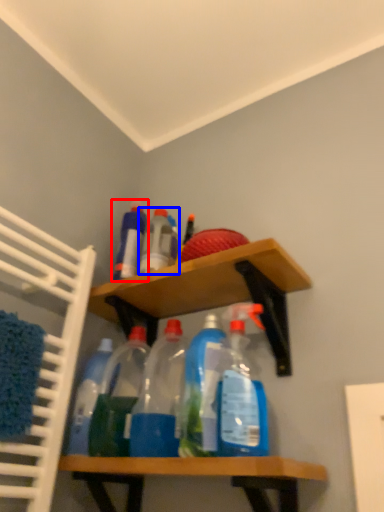
Question: Which of the following is the farthest to the observer, bottle (highlighted by a red box) or bottle (highlighted by a blue box)?

Choices:
 (A) bottle
 (B) bottle

Answer: (A)